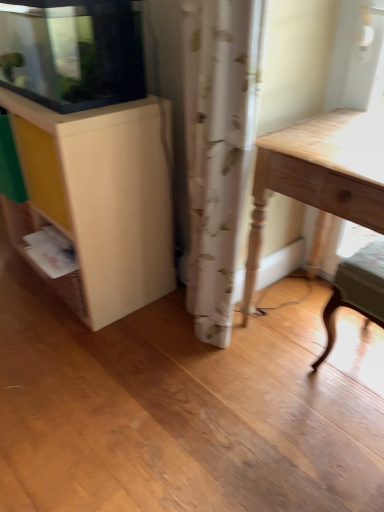
Question: Are wooden chair at lower right and light wood table at right far apart?

Choices:
 (A) yes
 (B) no

Answer: (B)

Question: From the image's perspective, would you say wooden chair at lower right is positioned over light wood table at right?

Choices:
 (A) no
 (B) yes

Answer: (A)

Question: Is wooden chair at lower right placed right next to light wood table at right?

Choices:
 (A) no
 (B) yes

Answer: (A)

Question: From the image's perspective, does wooden chair at lower right appear lower than light wood table at right?

Choices:
 (A) no
 (B) yes

Answer: (B)

Question: From a real-world perspective, is wooden chair at lower right physically below light wood table at right?

Choices:
 (A) yes
 (B) no

Answer: (A)

Question: Do you think matte white cabinet at left, which appears as the 2th cabinetry when viewed from the top, is within matte yellow drawer at left, or outside of it?

Choices:
 (A) outside
 (B) inside

Answer: (A)

Question: Considering the positions of matte white cabinet at left, which ranks as the first cabinetry in bottom-to-top order, and matte yellow drawer at left in the image, is matte white cabinet at left, which ranks as the first cabinetry in bottom-to-top order, bigger or smaller than matte yellow drawer at left?

Choices:
 (A) small
 (B) big

Answer: (B)

Question: Looking at their shapes, would you say matte white cabinet at left, which ranks as the first cabinetry in bottom-to-top order, is wider or thinner than matte yellow drawer at left?

Choices:
 (A) wide
 (B) thin

Answer: (A)

Question: From the image's perspective, is matte white cabinet at left, which appears as the 2th cabinetry when viewed from the top, above or below matte yellow drawer at left?

Choices:
 (A) above
 (B) below

Answer: (A)

Question: From the image's perspective, is matte yellow drawer at left above or below wooden chair at lower right?

Choices:
 (A) above
 (B) below

Answer: (A)

Question: From a real-world perspective, is matte yellow drawer at left physically located above or below wooden chair at lower right?

Choices:
 (A) below
 (B) above

Answer: (B)

Question: Looking at their shapes, would you say matte yellow drawer at left is wider or thinner than wooden chair at lower right?

Choices:
 (A) thin
 (B) wide

Answer: (A)

Question: Does point (26, 159) appear closer or farther from the camera than point (375, 248)?

Choices:
 (A) farther
 (B) closer

Answer: (A)

Question: Is matte white cabinet at left, which appears as the 2th cabinetry when viewed from the top, taller or shorter than light wood table at right?

Choices:
 (A) tall
 (B) short

Answer: (A)

Question: Considering their positions, is matte white cabinet at left, which ranks as the first cabinetry in bottom-to-top order, located in front of or behind light wood table at right?

Choices:
 (A) front
 (B) behind

Answer: (B)